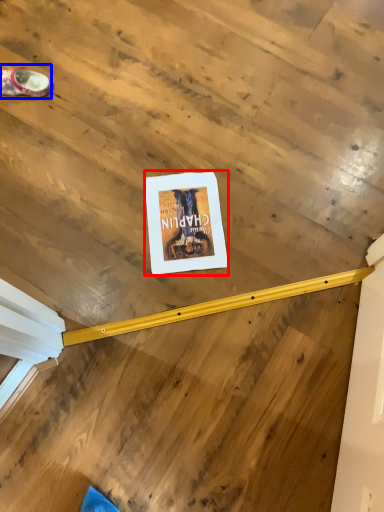
Question: Which point is further to the camera, poster page (highlighted by a red box) or footwear (highlighted by a blue box)?

Choices:
 (A) poster page
 (B) footwear

Answer: (B)